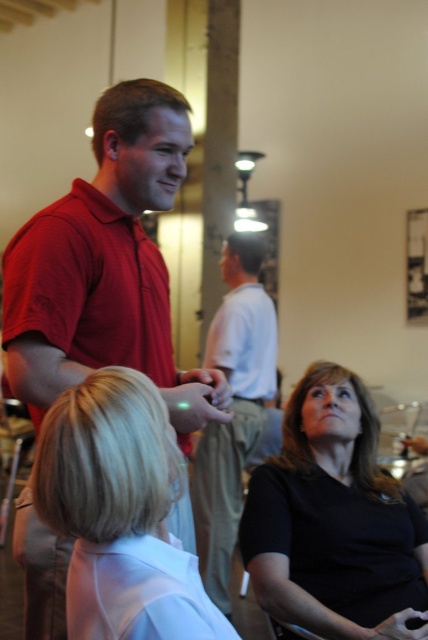
Between point (104, 480) and point (207, 364), which one is positioned behind?

Positioned behind is point (207, 364).

Consider the image. Who is higher up, blonde hair at center or light gray cotton shirt at center?

blonde hair at center is higher up.

Is point (145, 406) behind point (243, 442)?

No, it is in front of (243, 442).

Find the location of a particular element. blonde hair at center is located at coordinates (119, 513).

From the picture: Can you confirm if black matte shirt at lower right is wider than light gray cotton shirt at center?

Yes.

Does black matte shirt at lower right lie behind light gray cotton shirt at center?

That is False.

Which is behind, point (371, 424) or point (223, 588)?

Positioned behind is point (223, 588).

Find the location of a particular element. The width and height of the screenshot is (428, 640). black matte shirt at lower right is located at coordinates (333, 518).

Is point (149, 209) positioned before point (205, 356)?

Yes.

Between point (30, 243) and point (249, 307), which one is positioned in front?

Point (30, 243)

I want to click on matte red shirt at center, so click(107, 268).